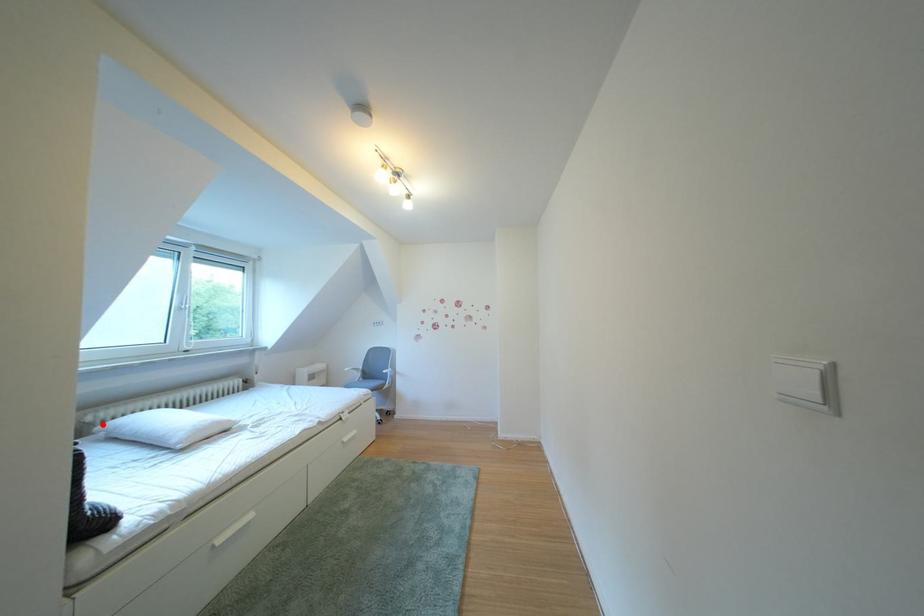
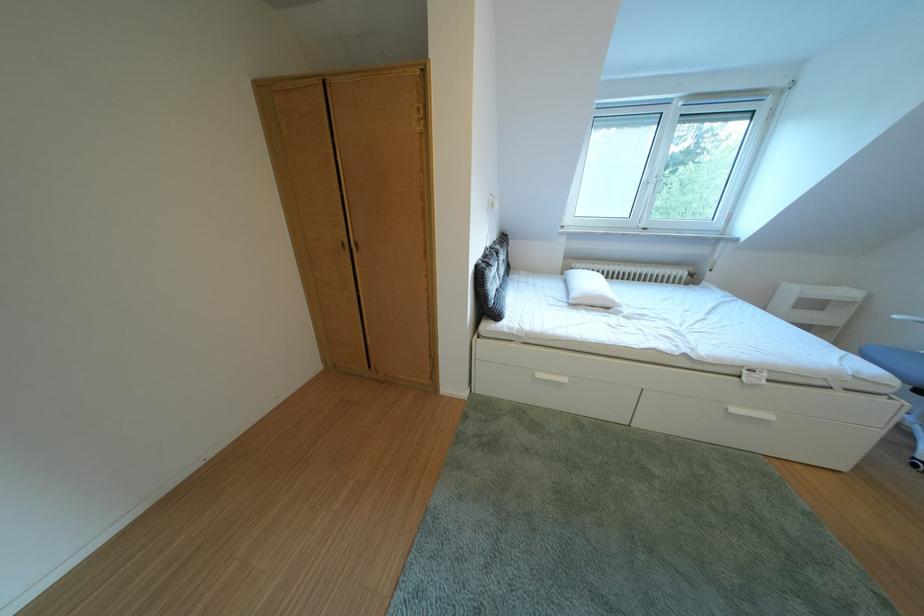
Where in the second image is the point corresponding to the highlighted location from the first image?

(588, 270)